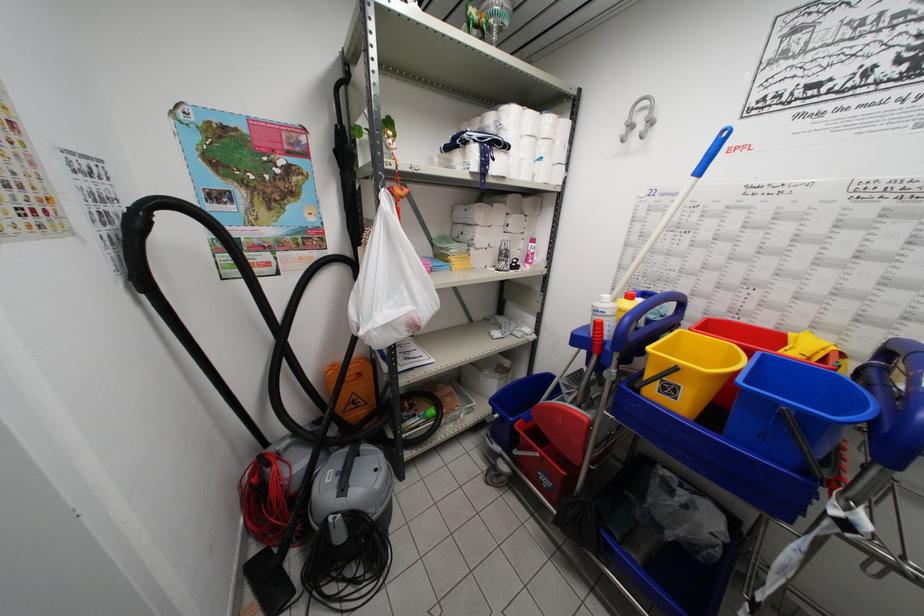
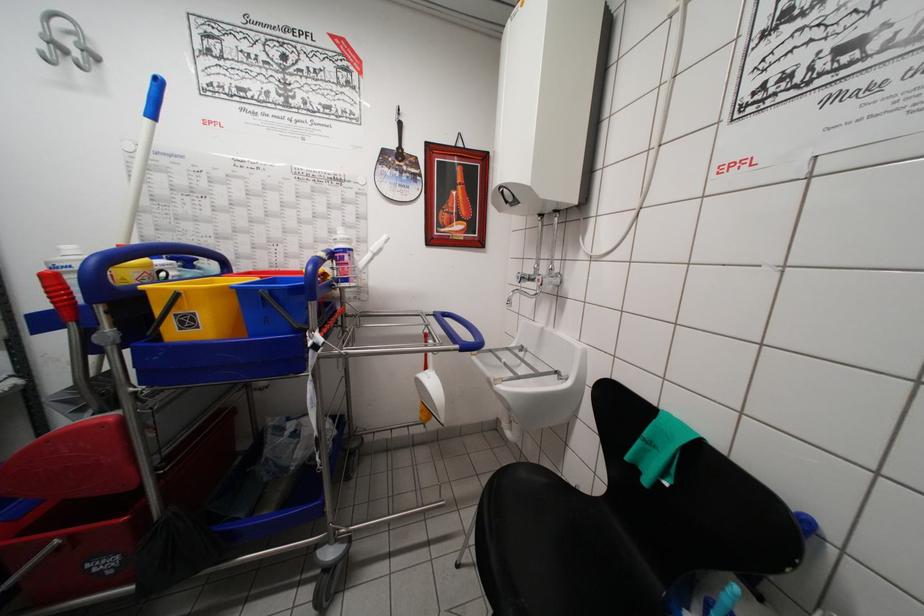
Find the pixel in the second image that matches (x=697, y=184) in the first image.

(151, 124)